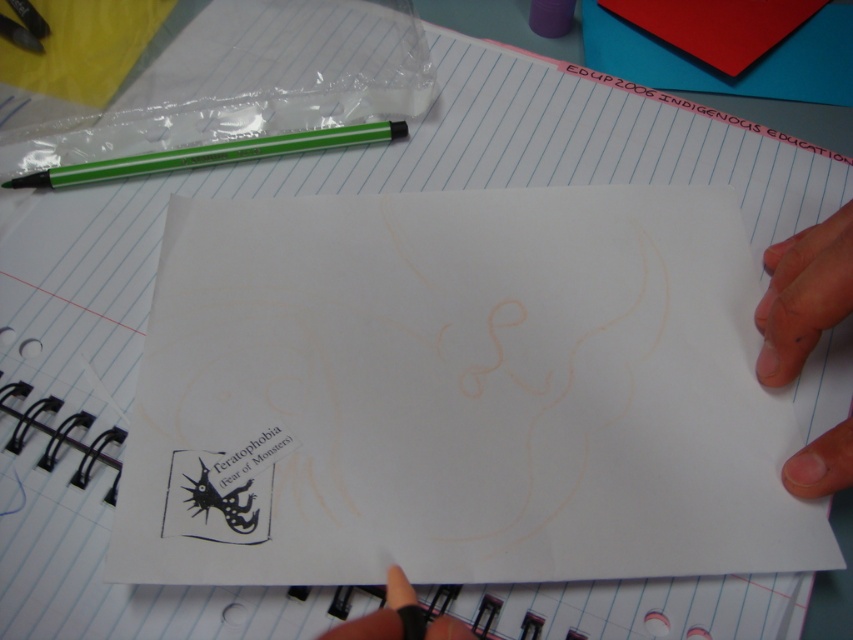
You are organizing your desk and need to stack items vertically. Given the dry skin at lower right and the green plastic pen at upper left, which item should you place at the bottom to ensure stability?

The dry skin at lower right has a greater height compared to the green plastic pen at upper left. To ensure stability, place the taller item, the dry skin at lower right, at the bottom of the stack.

You are a delivery robot with a package that is 20 inches long. You need to place it on the desk without overlapping any items. The desk has the point at (x=525, y=428) and another item at 0.500, 0.500. Can you fit the package between them?

The distance between the point at (x=525, y=428) and the other item at 0.500, 0.500 is 19.63 inches. Since the package is 20 inches long, it cannot fit between them as it would overlap the items.

You are organizing your desk and need to place the white paper at center and the green plastic pen at upper left into a storage box. The box has a height limit of 10 cm. Can both items fit vertically without bending or damaging them?

The white paper at center has a greater height compared to the green plastic pen at upper left. Since the box has a height limit of 10 cm, both items can fit vertically as long as their combined height does not exceed 10 cm. However, the exact dimensions of each item are not provided, so it depends on their individual heights.